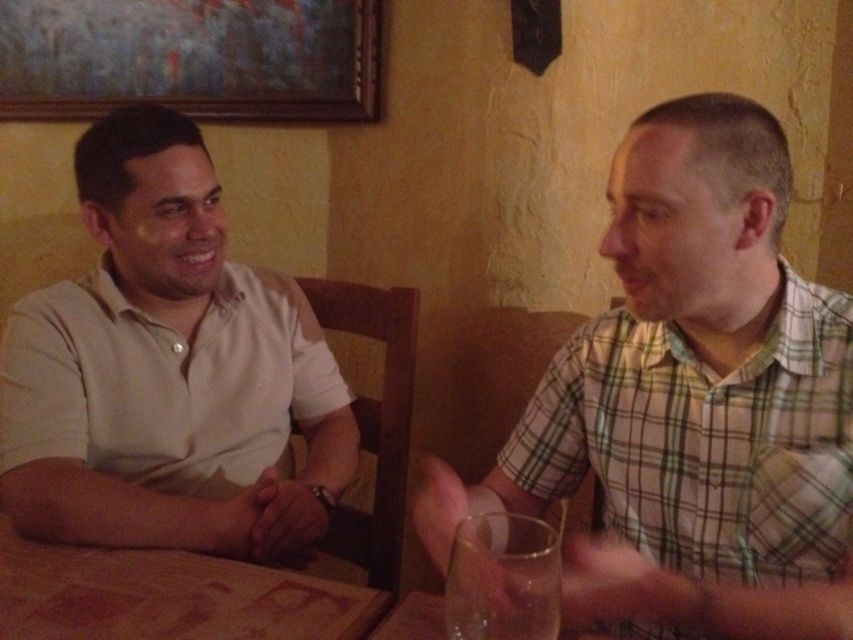
In order to click on painted wood picture frame at upper left in this screenshot , I will do `click(190, 58)`.

Is painted wood picture frame at upper left to the right of transparent glass at lower right from the viewer's perspective?

Incorrect, painted wood picture frame at upper left is not on the right side of transparent glass at lower right.

You are a GUI agent. You are given a task and a screenshot of the screen. Output one action in this format:
    pyautogui.click(x=<x>, y=<y>)
    Task: Click on the painted wood picture frame at upper left
    The height and width of the screenshot is (640, 853).
    Given the screenshot: What is the action you would take?
    pyautogui.click(x=190, y=58)

You are a GUI agent. You are given a task and a screenshot of the screen. Output one action in this format:
    pyautogui.click(x=<x>, y=<y>)
    Task: Click on the wooden table at center
    This screenshot has height=640, width=853.
    Given the screenshot: What is the action you would take?
    pyautogui.click(x=167, y=596)

Describe the element at coordinates (692, 403) in the screenshot. I see `green plaid shirt at right` at that location.

Is point (666, 570) in front of point (491, 636)?

No.

At what (x,y) coordinates should I click in order to perform the action: click on green plaid shirt at right. Please return your answer as a coordinate pair (x, y). Looking at the image, I should click on (692, 403).